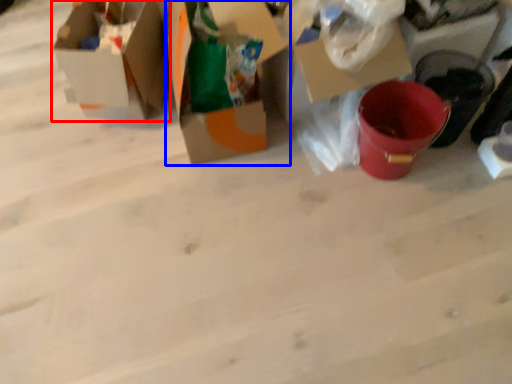
Question: Among these objects, which one is farthest to the camera, box (highlighted by a red box) or box (highlighted by a blue box)?

Choices:
 (A) box
 (B) box

Answer: (A)